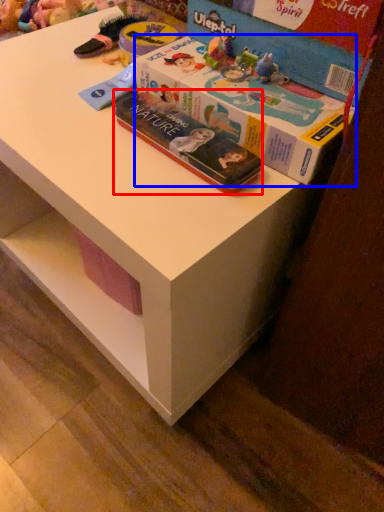
Question: Which of the following is the farthest to the observer, book (highlighted by a red box) or box (highlighted by a blue box)?

Choices:
 (A) book
 (B) box

Answer: (A)